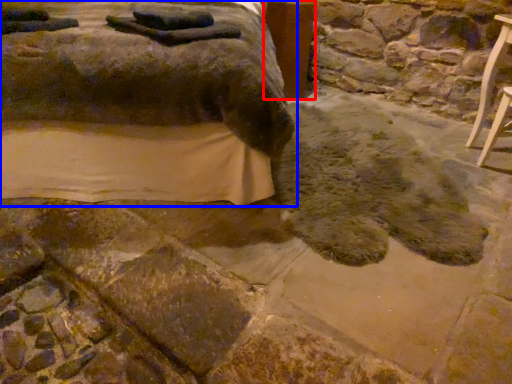
Question: Which object is closer to the camera taking this photo, table (highlighted by a red box) or furniture (highlighted by a blue box)?

Choices:
 (A) table
 (B) furniture

Answer: (B)